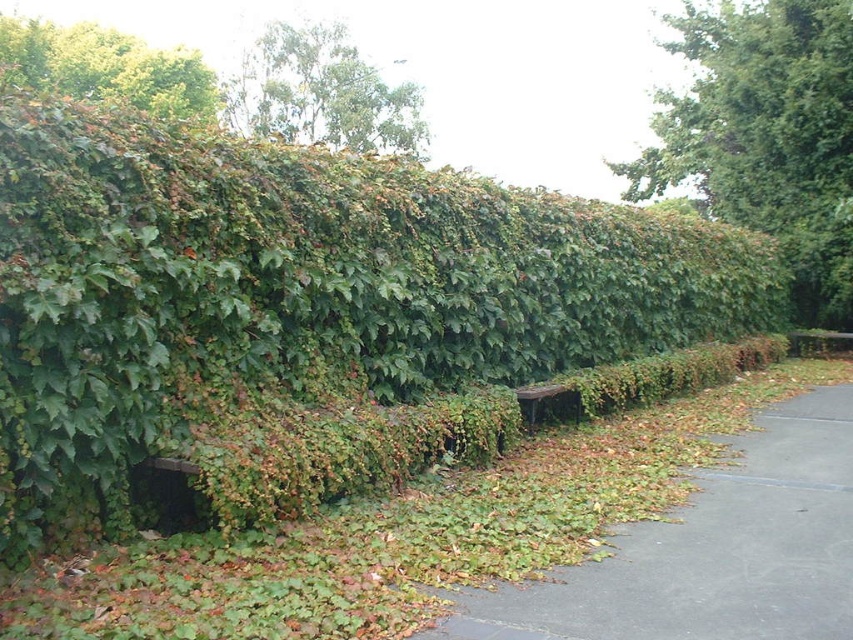
Is green leafy hedge at center positioned behind green leafy tree at upper left?

No, green leafy hedge at center is closer to the viewer.

Measure the distance between point (183, 355) and camera.

4.60 meters

Identify the location of green leafy hedge at center. (300, 285).

Which is above, gray asphalt pavement at lower right or wooden park bench at center?

wooden park bench at center

Can you confirm if gray asphalt pavement at lower right is bigger than wooden park bench at center?

Actually, gray asphalt pavement at lower right might be smaller than wooden park bench at center.

Is point (646, 528) behind point (561, 392)?

No, it is in front of (561, 392).

I want to click on gray asphalt pavement at lower right, so point(711,550).

Can you confirm if gray asphalt pavement at lower right is wider than green leafy tree at upper left?

Incorrect, gray asphalt pavement at lower right's width does not surpass green leafy tree at upper left's.

Between gray asphalt pavement at lower right and green leafy tree at upper left, which one appears on the right side from the viewer's perspective?

Positioned to the right is gray asphalt pavement at lower right.

Which is behind, point (544, 604) or point (96, 33)?

Positioned behind is point (96, 33).

Locate an element on the screen. gray asphalt pavement at lower right is located at coordinates (711, 550).